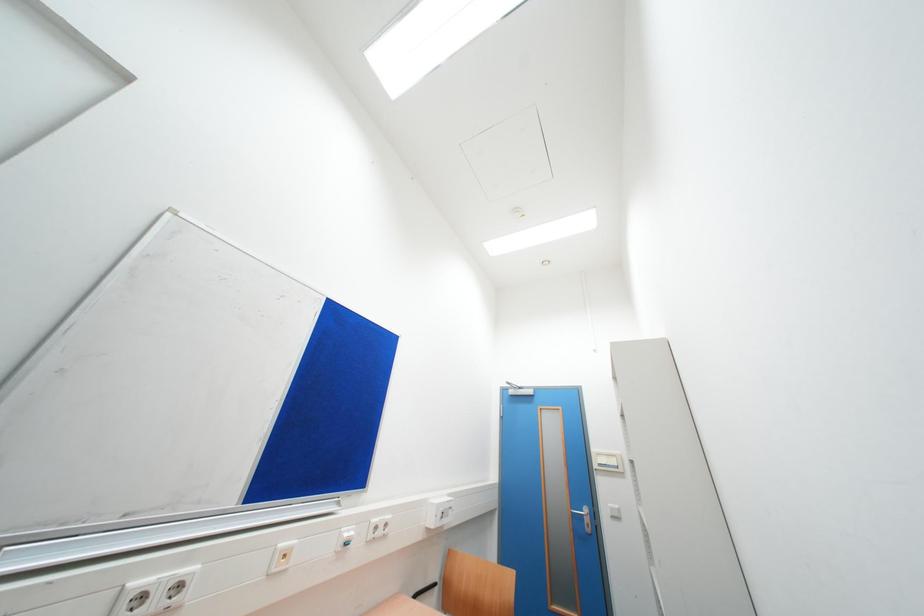
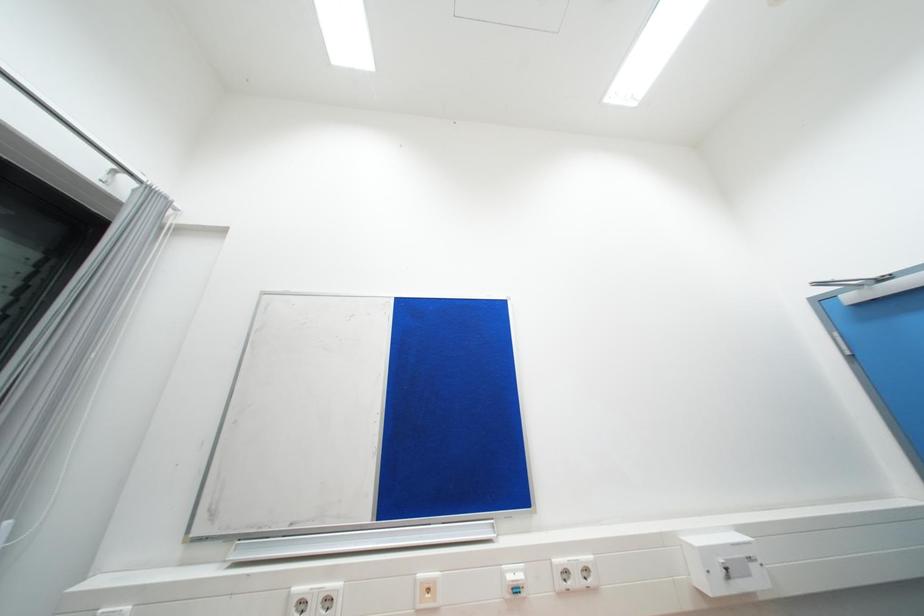
Question: The camera is either moving clockwise (left) or counter-clockwise (right) around the object. The first image is from the beginning of the video and the second image is from the end. Is the camera moving left or right when shooting the video?

Choices:
 (A) Left
 (B) Right

Answer: (B)